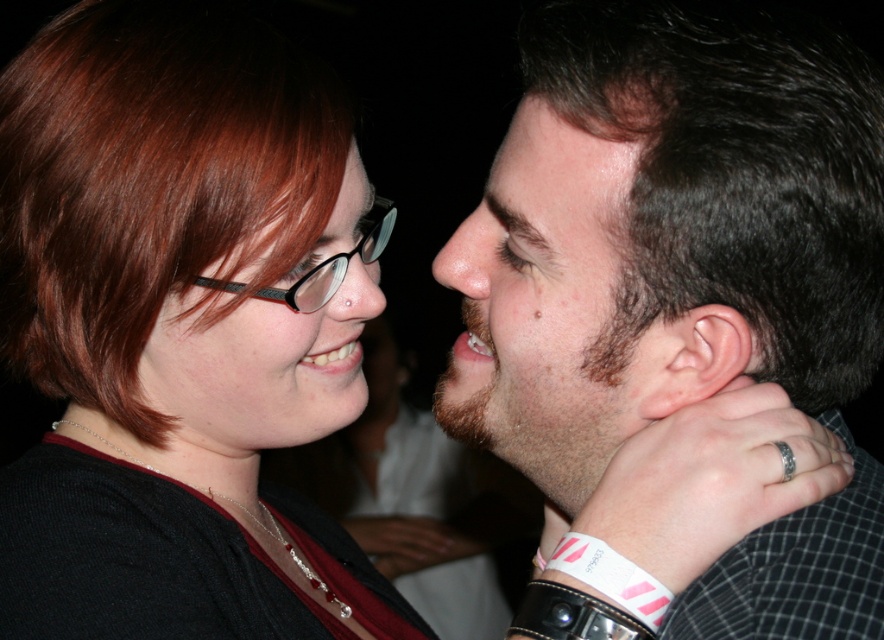
Question: Is brown hair at right behind matte black glasses at upper left?

Choices:
 (A) yes
 (B) no

Answer: (B)

Question: In this image, where is dark brown hair at center located relative to matte black glasses at upper left?

Choices:
 (A) above
 (B) below

Answer: (A)

Question: Among these points, which one is farthest from the camera?

Choices:
 (A) (588, 77)
 (B) (187, 308)
 (C) (113, 445)

Answer: (C)

Question: Which object appears closest to the camera in this image?

Choices:
 (A) silver chain necklace at center
 (B) pale skin ear at right
 (C) brown hair at right

Answer: (C)

Question: Can you confirm if brown hair at right is smaller than matte black glasses at upper left?

Choices:
 (A) no
 (B) yes

Answer: (B)

Question: Among these points, which one is nearest to the camera?

Choices:
 (A) (550, 83)
 (B) (184, 438)
 (C) (477, 269)
 (D) (212, 492)

Answer: (A)